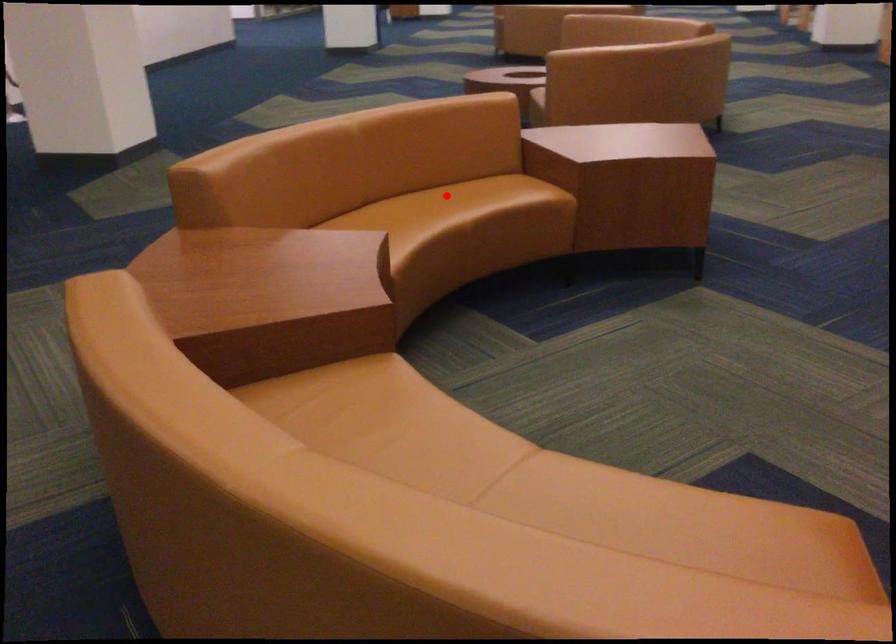
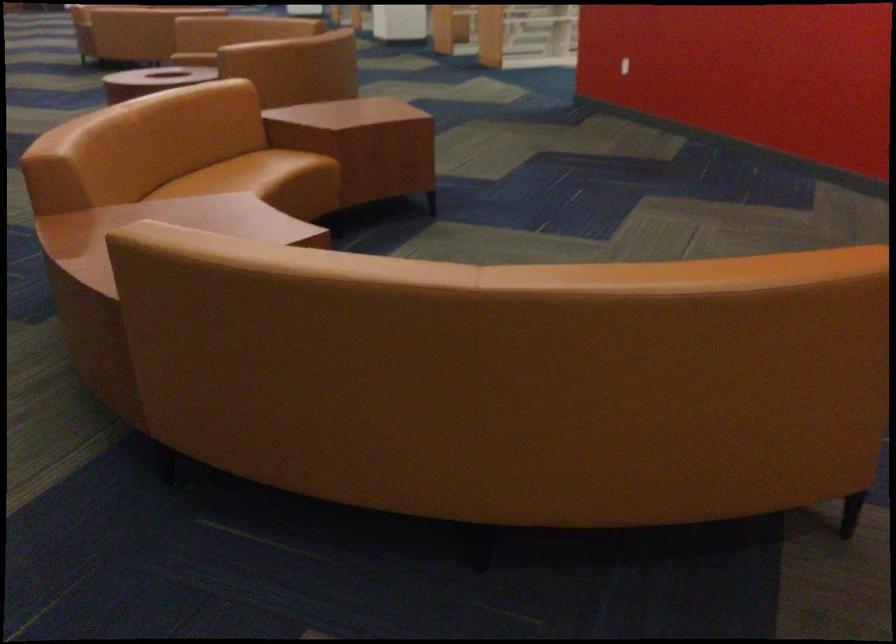
In the second image, find the point that corresponds to the highlighted location in the first image.

(236, 174)